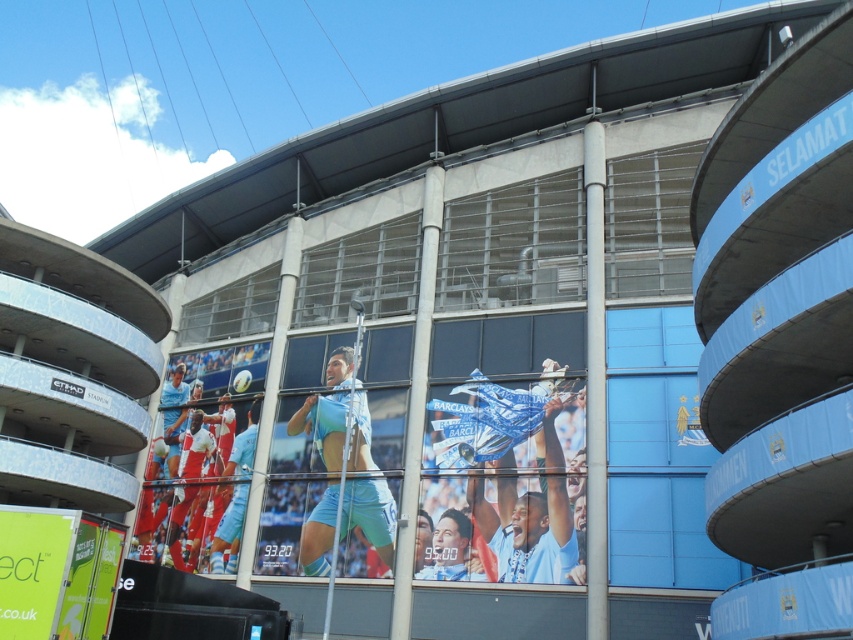
You are standing in the stadium and want to take a photo of both point (x=543, y=577) and point (x=204, y=445). Which point should you focus on first to ensure both are in focus?

You should focus on point (x=543, y=577) first because it is closer to the camera than point (x=204, y=445), ensuring both will be in focus when using depth of field.

Based on the photo, you are a drone operator tasked with capturing aerial footage of the blue fabric banner at center. The drone has a maximum flight range of 40 meters. Can the drone reach the banner from your current position?

The blue fabric banner at center is 41.77 meters away, which exceeds the drone maximum flight range of 40 meters. The drone cannot reach the banner from the current position.